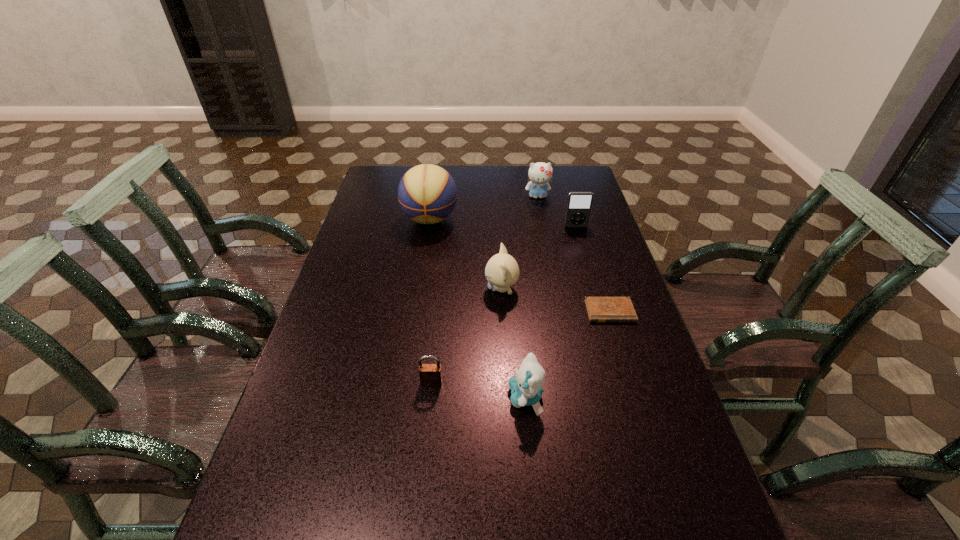
Where is `basketball`? The width and height of the screenshot is (960, 540). basketball is located at coordinates (427, 193).

Identify the location of the farthest kitten. This screenshot has width=960, height=540. (540, 173).

At what (x,y) coordinates should I click in order to perform the action: click on the farthest object. Please return your answer as a coordinate pair (x, y). The height and width of the screenshot is (540, 960). Looking at the image, I should click on (540, 173).

This screenshot has width=960, height=540. I want to click on iPod, so click(x=579, y=204).

What are the coordinates of `the second nearest kitten` in the screenshot? It's located at (502, 271).

Find the location of a particular element. Image resolution: width=960 pixels, height=540 pixels. the nearest kitten is located at coordinates (526, 388).

Identify the location of padlock. (430, 374).

Identify the location of the shortest object. point(599,309).

Where is `vacant area located on the patterned surface of the basketball`? vacant area located on the patterned surface of the basketball is located at coordinates (424, 256).

Image resolution: width=960 pixels, height=540 pixels. What are the coordinates of `vacant space situated 0.340m on the front-facing side of the farthest kitten` in the screenshot? It's located at (549, 257).